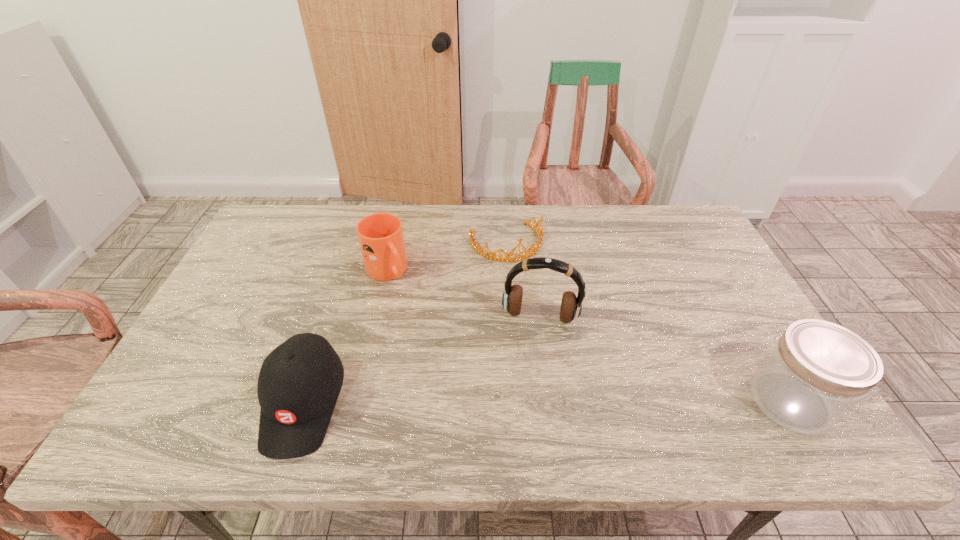
Identify the location of free space that satisfies the following two spatial constraints: 1. on the front side of the headset; 2. on the left side of the jar. This screenshot has height=540, width=960. (551, 401).

Locate an element on the screen. This screenshot has height=540, width=960. vacant position in the image that satisfies the following two spatial constraints: 1. on the front side of the mug; 2. on the left side of the rightmost object is located at coordinates (357, 401).